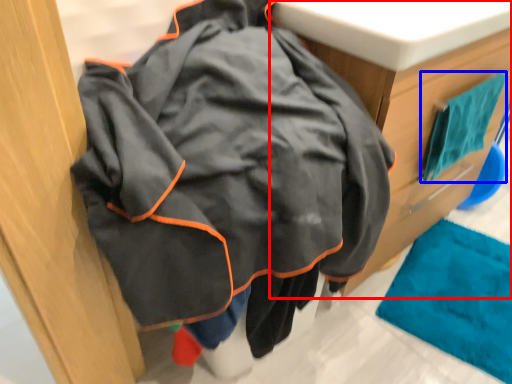
Question: Which object is further to the camera taking this photo, furniture (highlighted by a red box) or bath towel (highlighted by a blue box)?

Choices:
 (A) furniture
 (B) bath towel

Answer: (B)